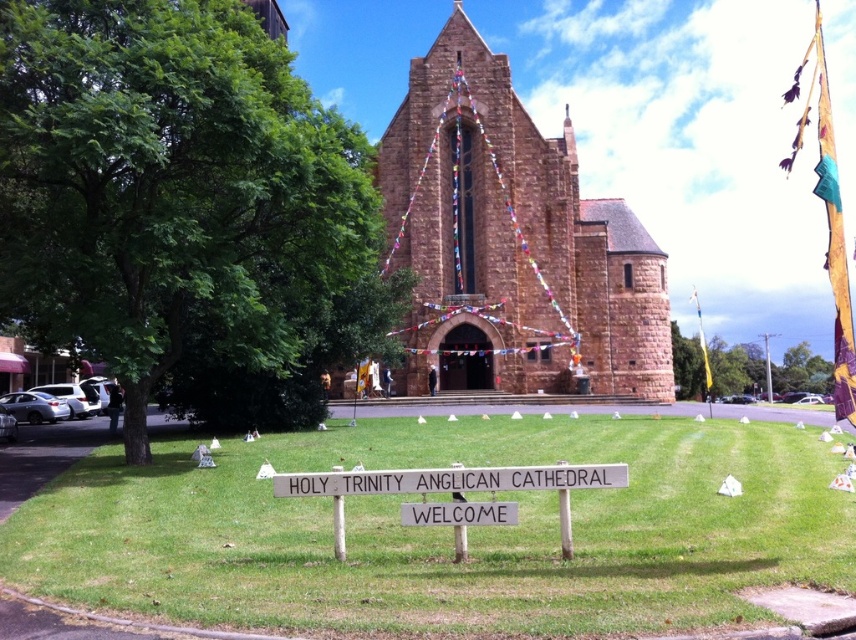
You are standing in front of the Holy Trinity Anglican Cathedral and want to take a photo that includes both the brown stone church at center and the white wooden sign at center. Which object should you position closer to the camera to ensure both are in focus?

You should position the white wooden sign at center closer to the camera because the brown stone church at center is further away, so adjusting the sign to be nearer will help both objects be in focus.